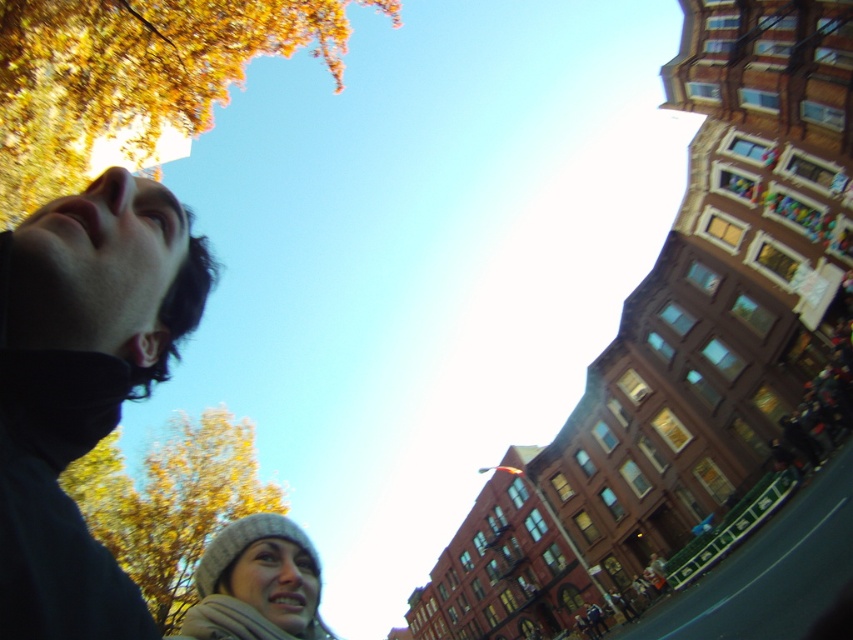
Does knitted gray hat at lower left have a lesser width compared to white soft scarf at lower center?

No.

How far apart are knitted gray hat at lower left and white soft scarf at lower center?

knitted gray hat at lower left is 20.82 inches from white soft scarf at lower center.

Who is more distant from viewer, (285, 602) or (228, 627)?

The point (285, 602) is behind.

At what (x,y) coordinates should I click in order to perform the action: click on knitted gray hat at lower left. Please return your answer as a coordinate pair (x, y). This screenshot has width=853, height=640. Looking at the image, I should click on (257, 582).

From the picture: Does golden leafy tree at upper left have a lesser height compared to white soft scarf at lower center?

Incorrect, golden leafy tree at upper left's height does not fall short of white soft scarf at lower center's.

Can you confirm if golden leafy tree at upper left is positioned to the left of white soft scarf at lower center?

Yes, golden leafy tree at upper left is to the left of white soft scarf at lower center.

Locate an element on the screen. golden leafy tree at upper left is located at coordinates (134, 76).

Is dark gray fabric face at upper left to the left of knitted gray hat at lower left from the viewer's perspective?

Correct, you'll find dark gray fabric face at upper left to the left of knitted gray hat at lower left.

Between dark gray fabric face at upper left and knitted gray hat at lower left, which one appears on the left side from the viewer's perspective?

Positioned to the left is dark gray fabric face at upper left.

Which is in front, point (155, 260) or point (277, 609)?

Point (155, 260)

Identify the location of dark gray fabric face at upper left. This screenshot has height=640, width=853. (82, 387).